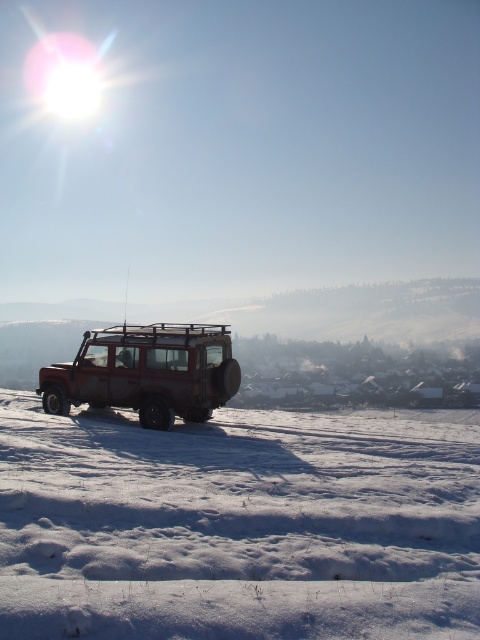
Question: Does white powdery snow at center have a lesser width compared to rusty metal jeep at center?

Choices:
 (A) yes
 (B) no

Answer: (B)

Question: Does white powdery snow at center appear on the left side of rusty metal jeep at center?

Choices:
 (A) no
 (B) yes

Answer: (A)

Question: Does white powdery snow at center appear on the right side of rusty metal jeep at center?

Choices:
 (A) no
 (B) yes

Answer: (B)

Question: Which object is farther from the camera taking this photo?

Choices:
 (A) white powdery snow at center
 (B) rusty metal jeep at center

Answer: (B)

Question: Which point appears closest to the camera in this image?

Choices:
 (A) (141, 401)
 (B) (477, 595)

Answer: (B)